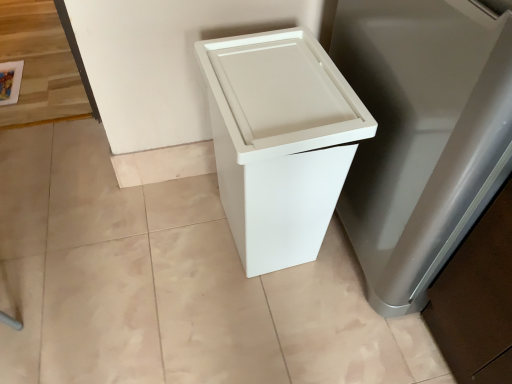
This screenshot has height=384, width=512. What are the coordinates of `vacant space positioned to the left of white matte trash can at center` in the screenshot? It's located at (169, 236).